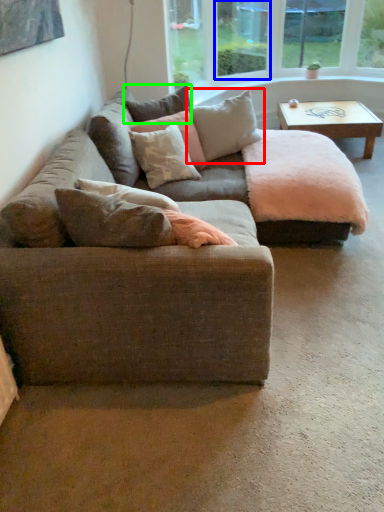
Question: Which object is the closest to the pillow (highlighted by a red box)? Choose among these: window screen (highlighted by a blue box) or pillow (highlighted by a green box).

Choices:
 (A) window screen
 (B) pillow

Answer: (B)